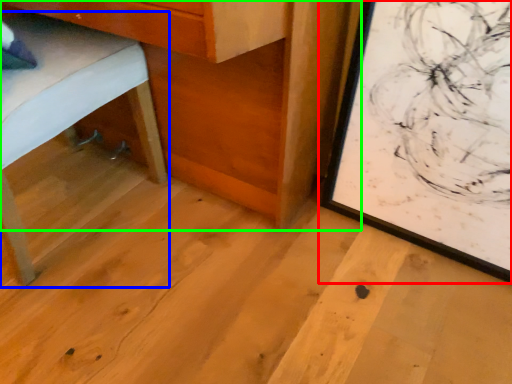
Question: Considering the real-world distances, which object is closest to picture frame (highlighted by a red box)? furniture (highlighted by a blue box) or table (highlighted by a green box).

Choices:
 (A) furniture
 (B) table

Answer: (B)